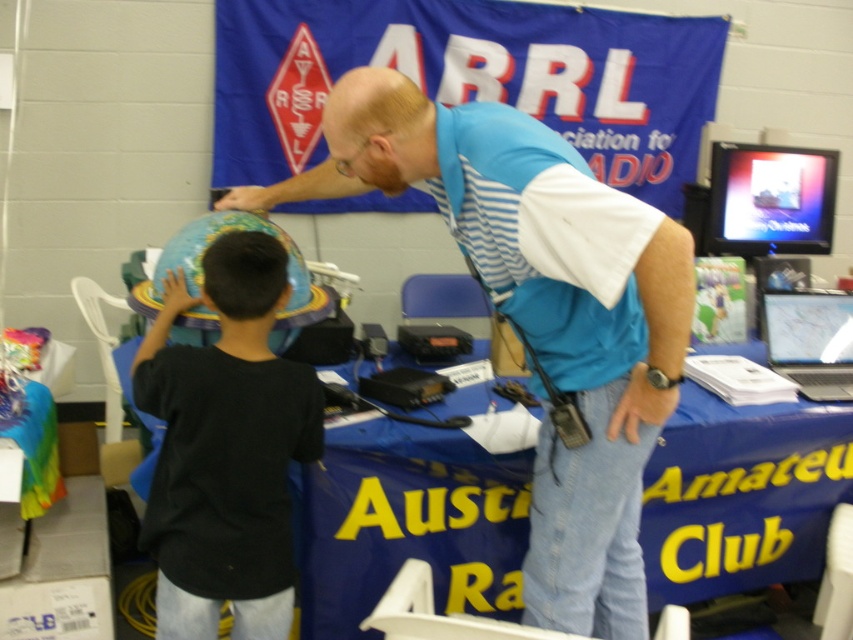
You are a photographer taking a picture of the scene. You notice the black matte globe at left and the bald scalp at upper center. Which object should you focus on if you want to capture the wider subject in your shot?

The black matte globe at left is wider than the bald scalp at upper center, so you should focus on the black matte globe at left to capture the wider subject.

You are a photographer trying to capture a photo of the bald scalp at upper center. The black matte globe at left is blocking your view. Can you move the globe to the right to get a clear shot?

The black matte globe at left is to the left of bald scalp at upper center, so moving it to the right would place it out of the way, allowing you to capture the bald scalp at upper center without obstruction.